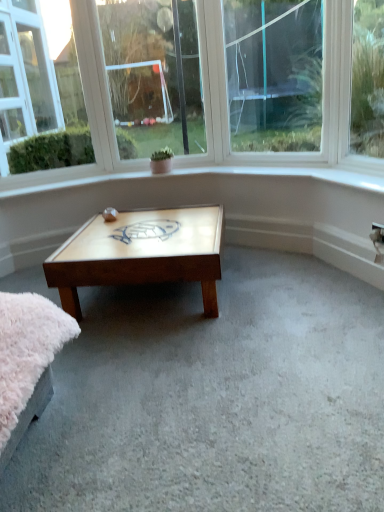
Question: From a real-world perspective, is clear glass window at upper center, the third window when ordered from left to right, located higher than wooden turtle at center?

Choices:
 (A) yes
 (B) no

Answer: (A)

Question: Is clear glass window at upper center, the 1th window when ordered from right to left, aimed at wooden turtle at center?

Choices:
 (A) yes
 (B) no

Answer: (A)

Question: Is clear glass window at upper center, the 1th window when ordered from right to left, completely or partially outside of wooden turtle at center?

Choices:
 (A) yes
 (B) no

Answer: (A)

Question: Can you confirm if clear glass window at upper center, the third window when ordered from left to right, is shorter than wooden turtle at center?

Choices:
 (A) yes
 (B) no

Answer: (B)

Question: Would you consider clear glass window at upper center, the third window when ordered from left to right, to be distant from wooden turtle at center?

Choices:
 (A) yes
 (B) no

Answer: (A)

Question: From a real-world perspective, is clear glass window at upper center, the 1th window when ordered from right to left, under wooden turtle at center?

Choices:
 (A) no
 (B) yes

Answer: (A)

Question: Could you tell me if clear glass window at upper center, the third window when ordered from left to right, is facing wooden turtle design at center?

Choices:
 (A) yes
 (B) no

Answer: (A)

Question: Are clear glass window at upper center, the 1th window when ordered from right to left, and wooden turtle design at center located far from each other?

Choices:
 (A) no
 (B) yes

Answer: (B)

Question: Is wooden turtle design at center completely or partially inside clear glass window at upper center, the third window when ordered from left to right?

Choices:
 (A) no
 (B) yes

Answer: (A)

Question: From a real-world perspective, does clear glass window at upper center, the 1th window when ordered from right to left, sit lower than wooden turtle design at center?

Choices:
 (A) yes
 (B) no

Answer: (B)

Question: Does clear glass window at upper center, the third window when ordered from left to right, touch wooden turtle design at center?

Choices:
 (A) no
 (B) yes

Answer: (A)

Question: Considering the relative sizes of clear glass window at upper center, the 1th window when ordered from right to left, and wooden turtle design at center in the image provided, is clear glass window at upper center, the 1th window when ordered from right to left, thinner than wooden turtle design at center?

Choices:
 (A) yes
 (B) no

Answer: (A)

Question: Does wooden turtle at center lie in front of clear glass window at upper center, positioned as the second window in right-to-left order?

Choices:
 (A) no
 (B) yes

Answer: (B)